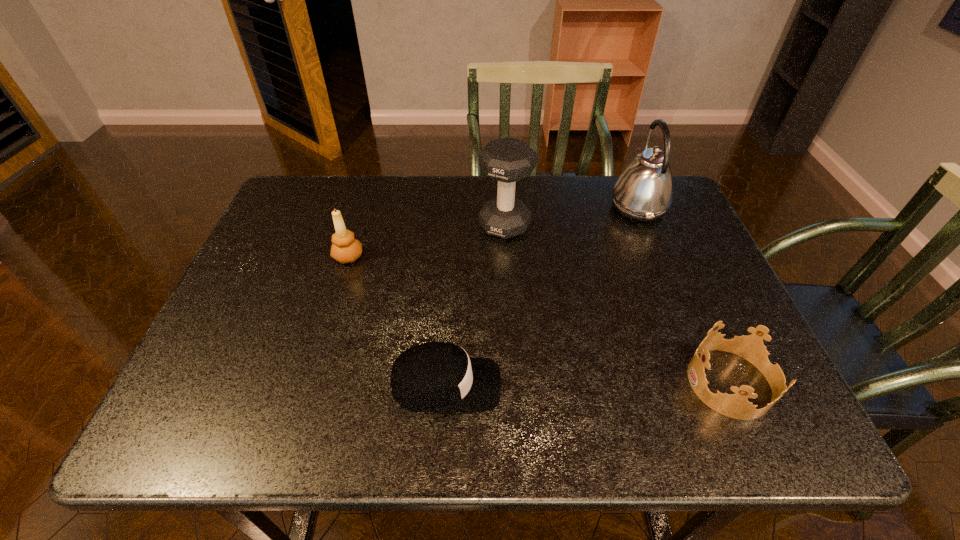
In order to click on tiara that is at the right edge in this screenshot , I will do `click(751, 347)`.

Locate an element on the screen. The image size is (960, 540). object at the far right corner is located at coordinates (644, 192).

The width and height of the screenshot is (960, 540). What are the coordinates of `object present at the near right corner` in the screenshot? It's located at (751, 347).

Image resolution: width=960 pixels, height=540 pixels. I want to click on free space at the far edge, so click(486, 188).

The image size is (960, 540). In the image, there is a desktop. What are the coordinates of `vacant space at the left edge` in the screenshot? It's located at (265, 362).

In order to click on vacant space at the right edge in this screenshot , I will do `click(679, 232)`.

In the image, there is a desktop. Where is `vacant space at the far left corner`? The height and width of the screenshot is (540, 960). vacant space at the far left corner is located at coordinates (321, 182).

Identify the location of free region at the far right corner of the desktop. (656, 224).

Where is `blank region between the tiara and the leftmost object`? The image size is (960, 540). blank region between the tiara and the leftmost object is located at coordinates (540, 320).

This screenshot has height=540, width=960. What are the coordinates of `unoccupied area between the kettle and the dumbbell` in the screenshot? It's located at (571, 216).